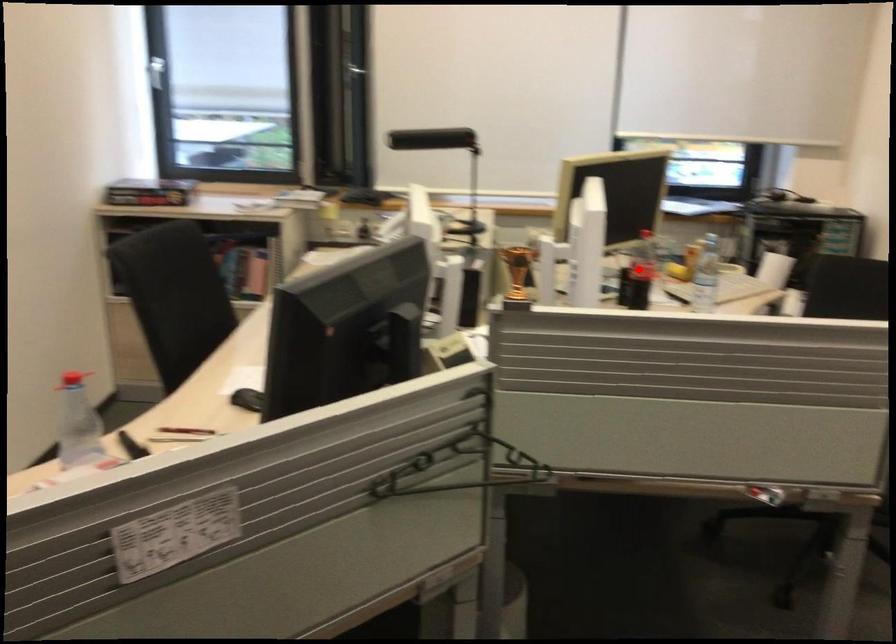
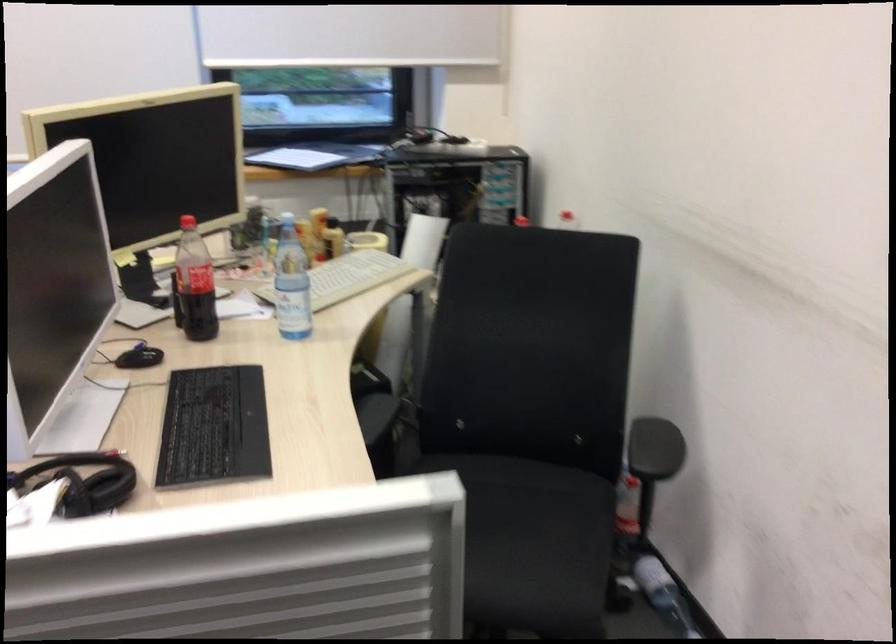
Where in the second image is the point corresponding to the highlighted location from the first image?

(194, 283)